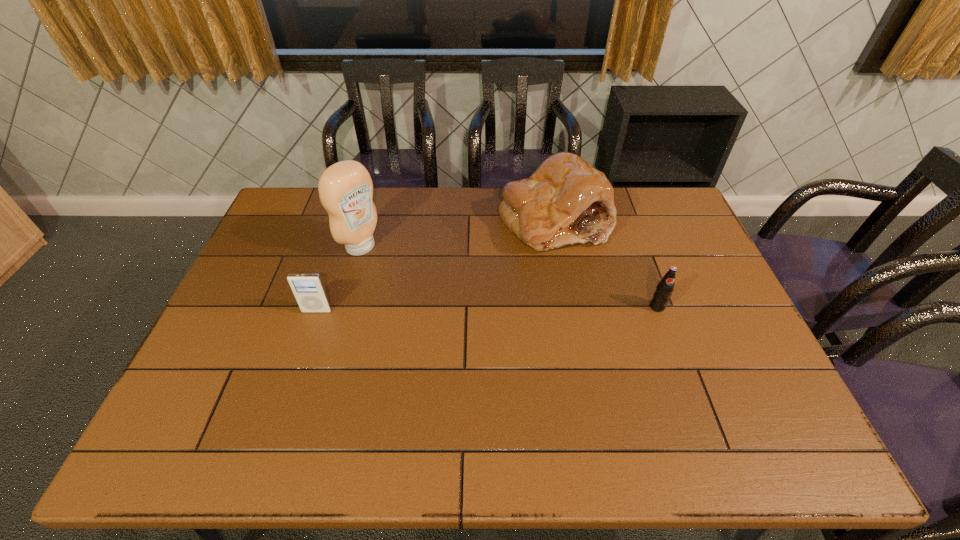
Locate an element on the screen. iPod is located at coordinates (308, 289).

The width and height of the screenshot is (960, 540). In order to click on the rightmost object in this screenshot , I will do `click(665, 287)`.

You are a GUI agent. You are given a task and a screenshot of the screen. Output one action in this format:
    pyautogui.click(x=<x>, y=<y>)
    Task: Click on the condiment
    
    Given the screenshot: What is the action you would take?
    pyautogui.click(x=345, y=188)

Locate an element on the screen. This screenshot has width=960, height=540. bread is located at coordinates (566, 201).

Identify the location of the third shortest object. Image resolution: width=960 pixels, height=540 pixels. (566, 201).

This screenshot has height=540, width=960. I want to click on vacant area situated on the front-facing side of the iPod, so click(298, 368).

Where is `blank area located on the front label of the rightmost object`? The width and height of the screenshot is (960, 540). blank area located on the front label of the rightmost object is located at coordinates (690, 399).

The width and height of the screenshot is (960, 540). Find the location of `vacant space located on the label of the condiment`. vacant space located on the label of the condiment is located at coordinates (465, 319).

Locate an element on the screen. The image size is (960, 540). vacant region located 0.140m on the label of the condiment is located at coordinates (404, 278).

At what (x,y) coordinates should I click in order to perform the action: click on free region located 0.230m on the label of the condiment. Please return your answer as a coordinate pair (x, y). Looking at the image, I should click on (424, 292).